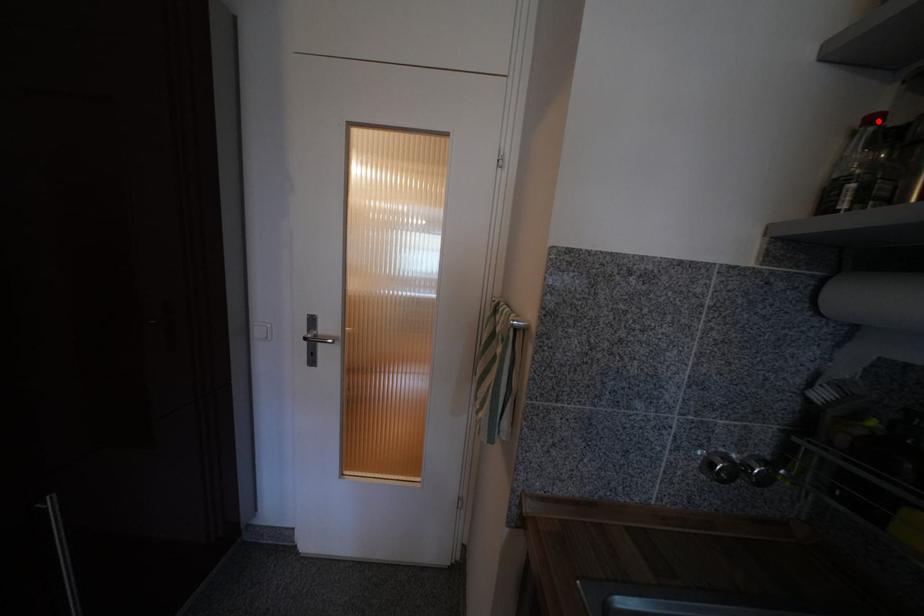
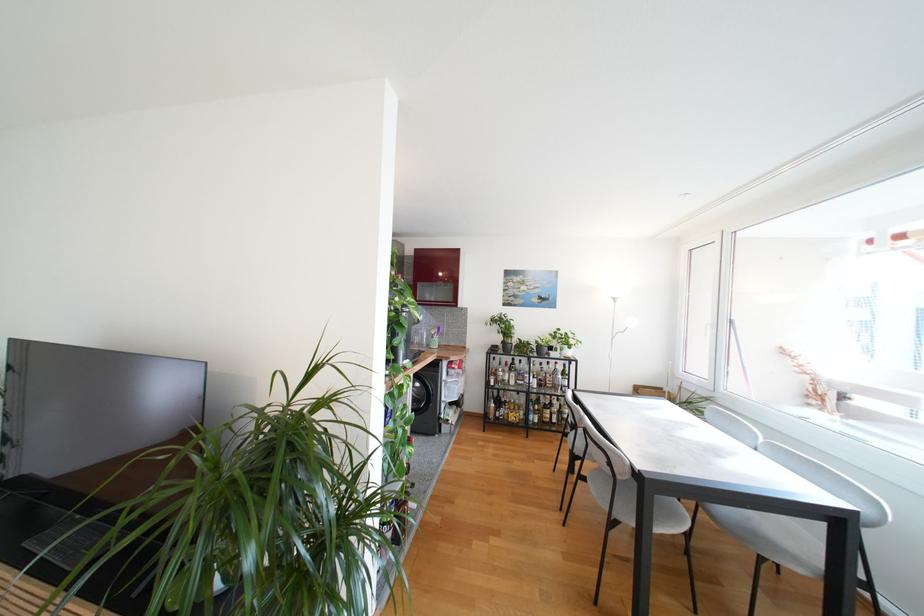
Question: I am providing you with two images of the same scene from different viewpoints. A red point is marked on the first image. Is the red point's position out of view in image 2?

Choices:
 (A) Yes
 (B) No

Answer: (A)